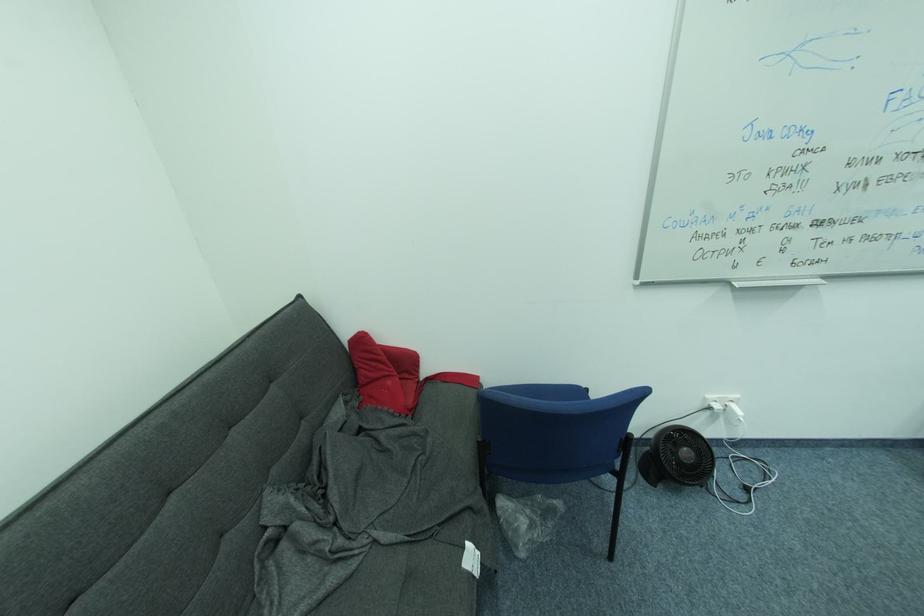
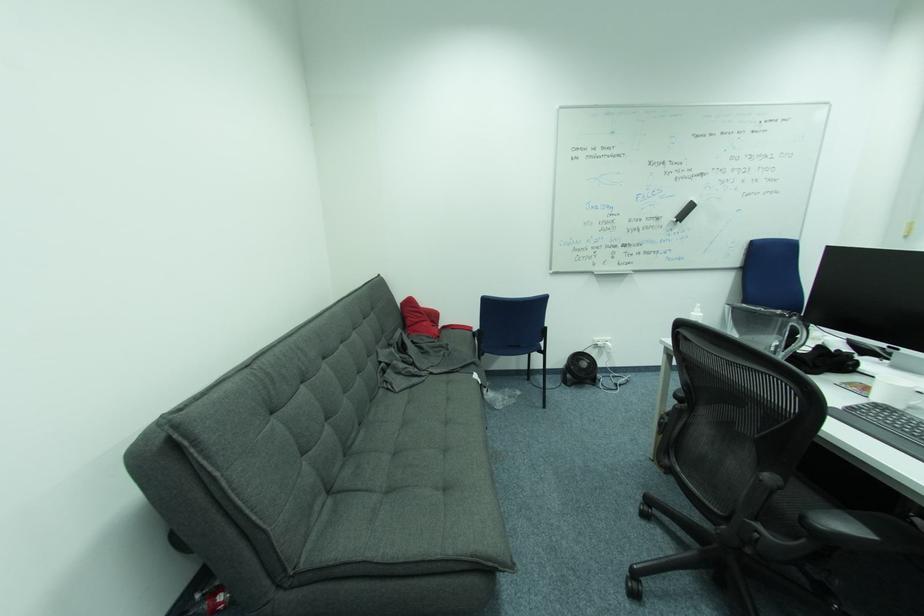
Question: What movement of the cameraman would produce the second image?

Choices:
 (A) Left
 (B) Right
 (C) Forward
 (D) Backward

Answer: (D)